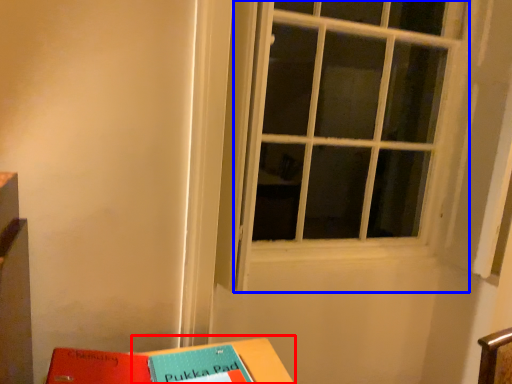
Question: Which object is further to the camera taking this photo, table (highlighted by a red box) or window (highlighted by a blue box)?

Choices:
 (A) table
 (B) window

Answer: (B)